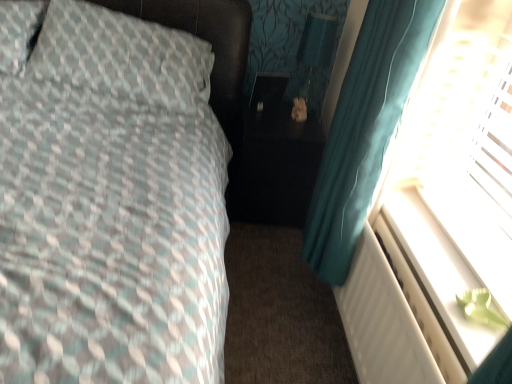
Where is `empty space that is ontop of matte black table lamp at center (from a real-world perspective)`? The height and width of the screenshot is (384, 512). empty space that is ontop of matte black table lamp at center (from a real-world perspective) is located at coordinates (321, 22).